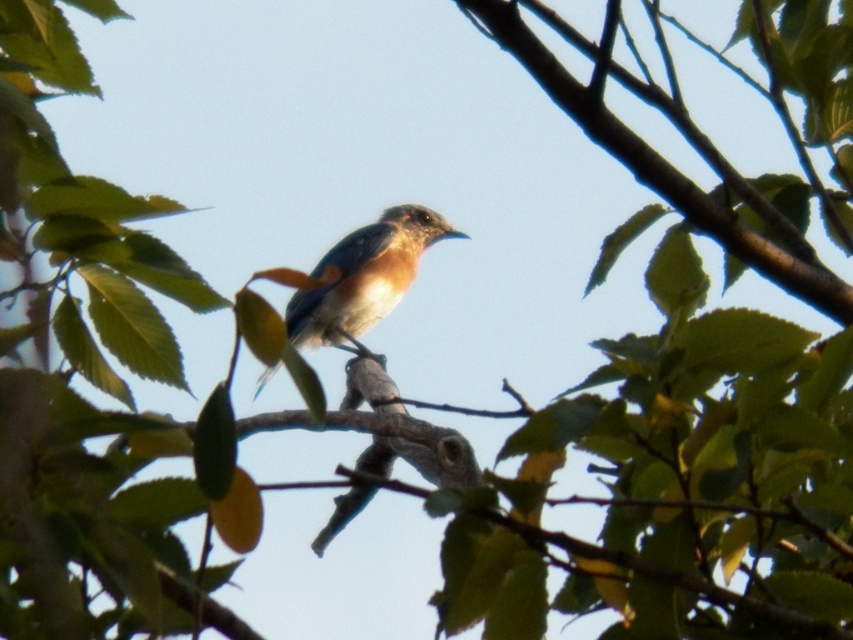
Is brown wood tree branch at center wider than blue glossy bird at center?

Incorrect, brown wood tree branch at center's width does not surpass blue glossy bird at center's.

Is the position of brown wood tree branch at center more distant than that of blue glossy bird at center?

That is False.

Is point (753, 248) closer to viewer compared to point (405, 285)?

Yes, point (753, 248) is in front of point (405, 285).

Find the location of `brown wood tree branch at center`. brown wood tree branch at center is located at coordinates (657, 164).